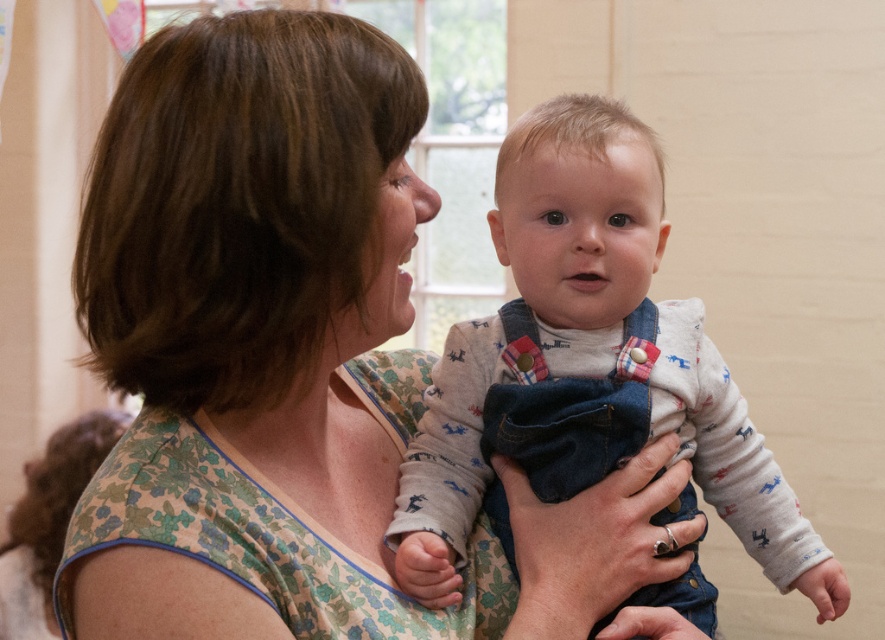
Is floral fabric dress at center taller than denim overalls at center?

No, floral fabric dress at center is not taller than denim overalls at center.

Can you confirm if floral fabric dress at center is smaller than denim overalls at center?

Actually, floral fabric dress at center might be larger than denim overalls at center.

Between point (97, 188) and point (436, 458), which one is positioned behind?

Point (436, 458)

Find the location of a particular element. The image size is (885, 640). floral fabric dress at center is located at coordinates (291, 360).